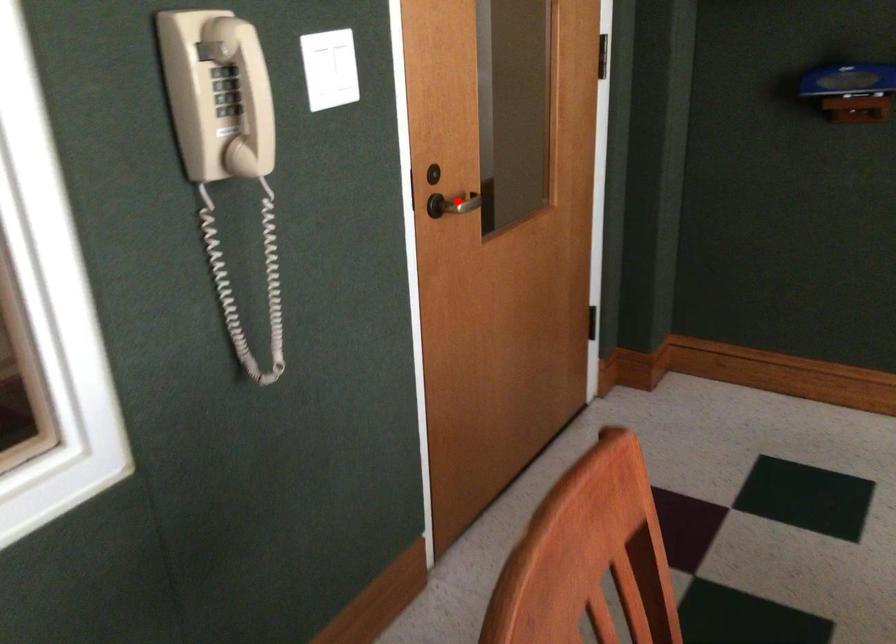
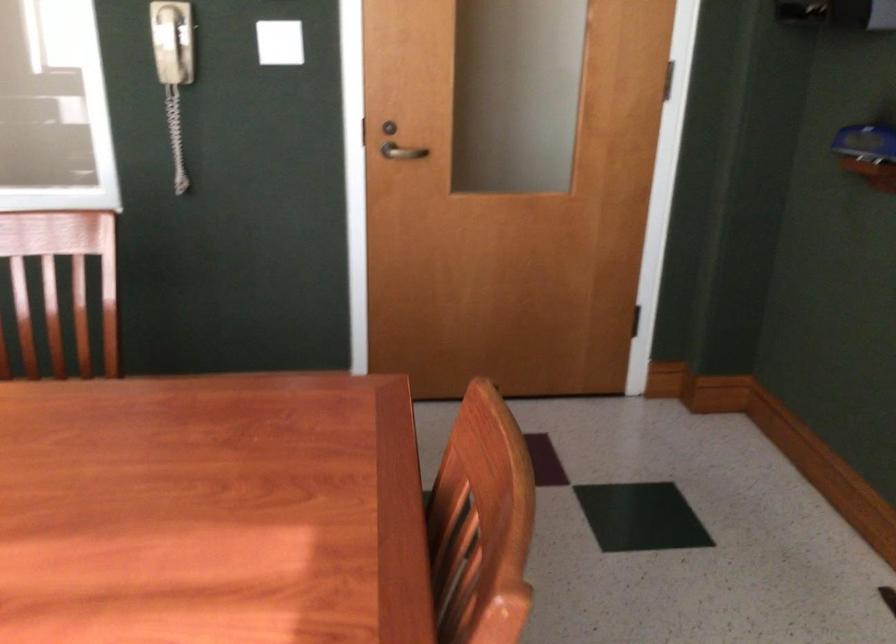
Find the pixel in the second image that matches the highlighted location in the first image.

(401, 152)